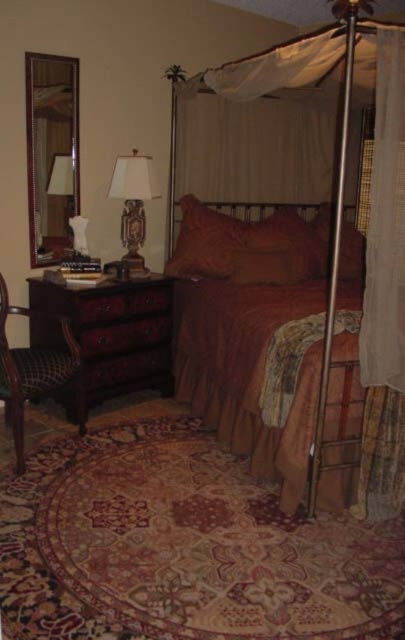
You are standing in the bedroom and want to reach both the point at coordinates point (91,310) and the point at coordinates point (366,355). Which point is closer to you?

The point at coordinates point (91,310) is closer to you than the point at coordinates point (366,355) because it is further to the viewer.